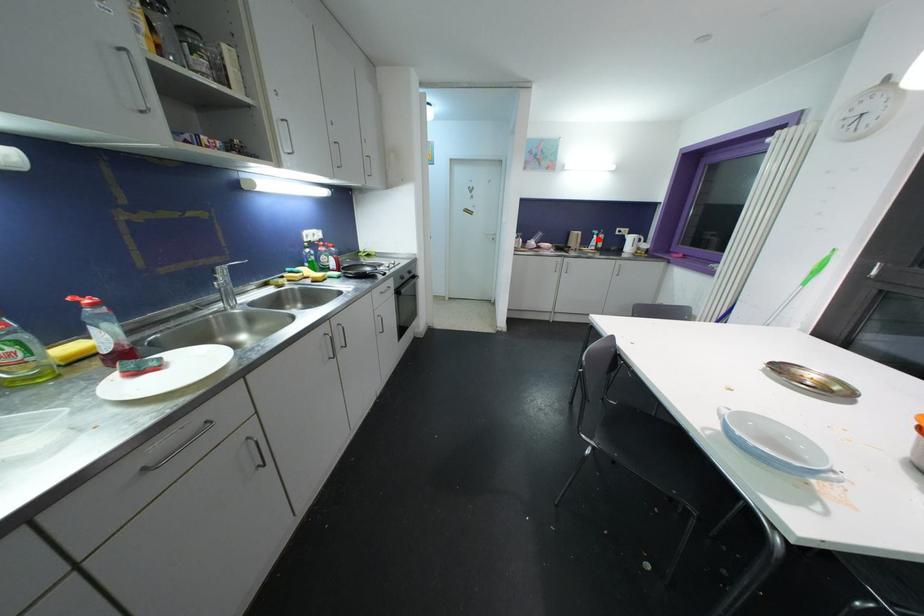
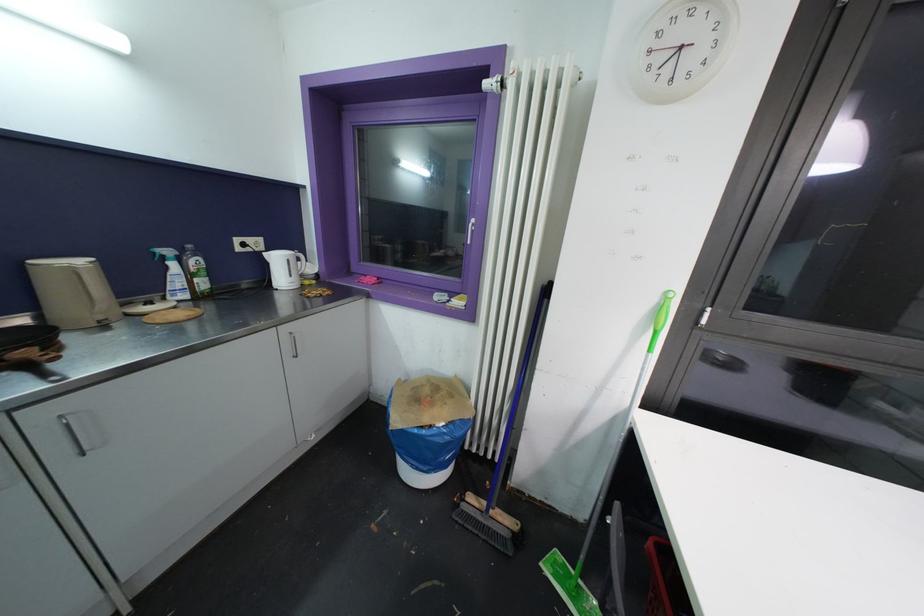
Question: I am providing you with two images of the same scene from different viewpoints. In image1, a red point is highlighted. Considering the same 3D point in image2, which of the following is correct?

Choices:
 (A) It is closer
 (B) It is farther

Answer: (B)